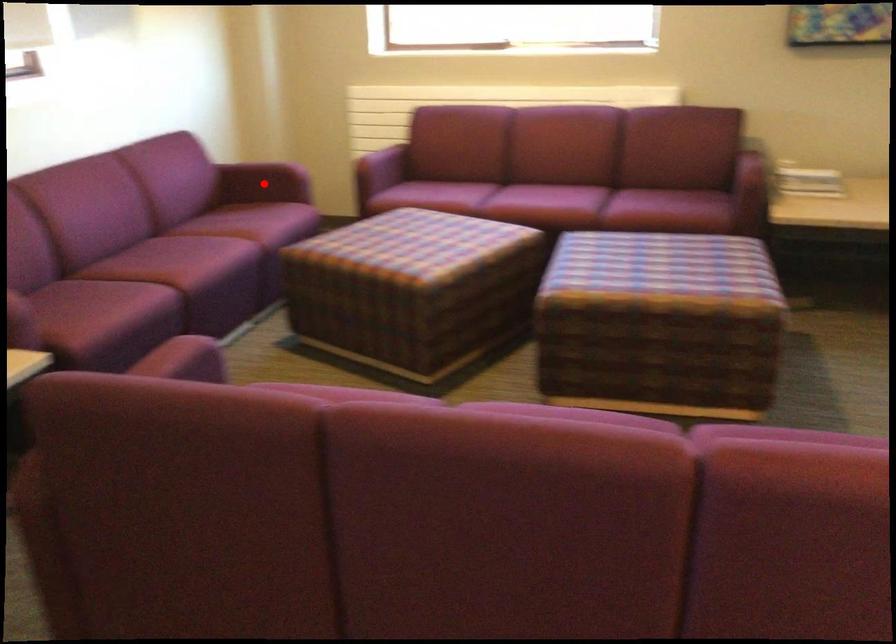
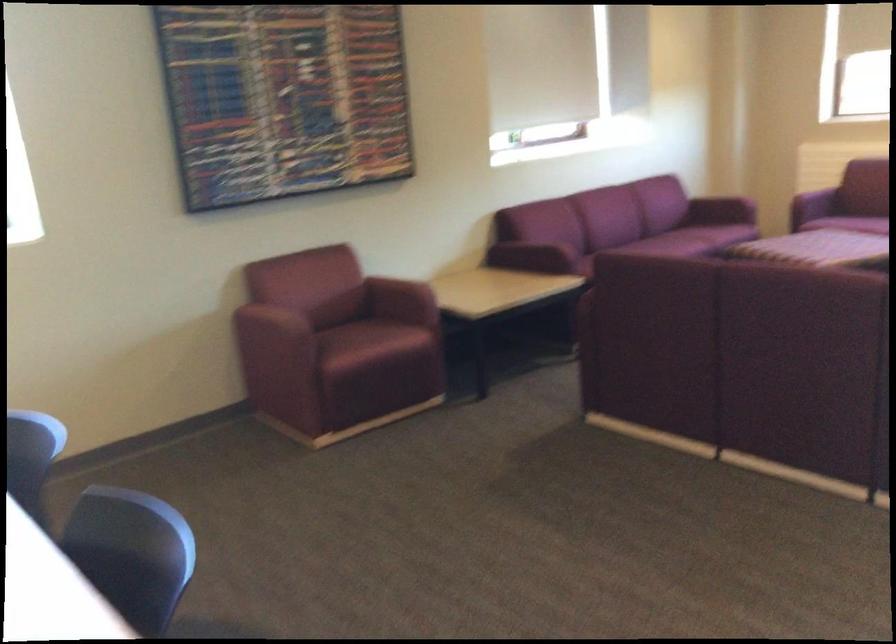
Where in the second image is the point corresponding to the highlighted location from the first image?

(720, 211)